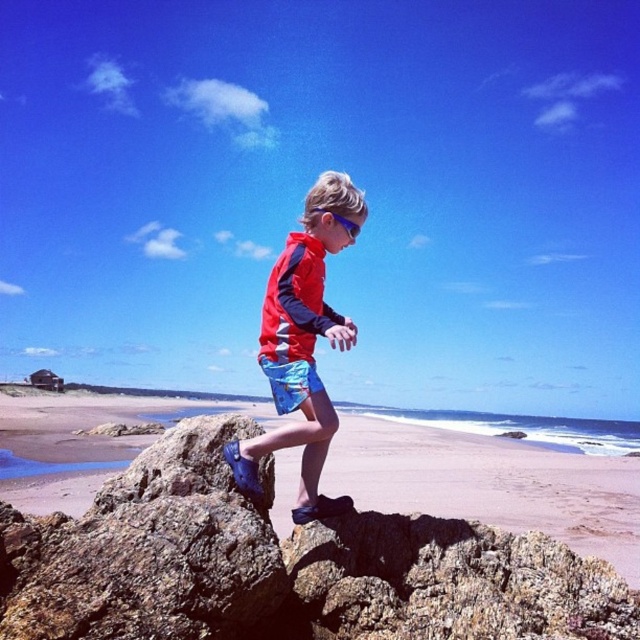
You are a photographer standing at the beach scene. You want to take a photo of the two points mentioned in the scene. Which point is closer to your camera, point (x=314, y=461) or point (x=301, y=401)?

Point (x=301, y=401) is closer to the camera because the description states that point (x=314, y=461) is further away than point (x=301, y=401).